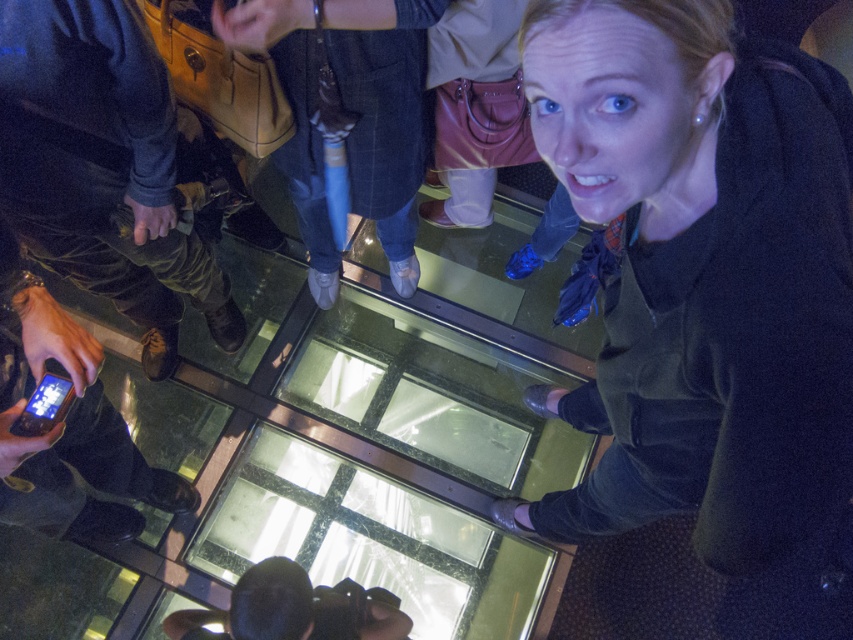
Question: Which point appears closest to the camera in this image?

Choices:
 (A) (160, 339)
 (B) (746, 147)

Answer: (B)

Question: Is velvet black sweater at upper right wider than camouflage pants at left?

Choices:
 (A) no
 (B) yes

Answer: (B)

Question: Is velvet black sweater at upper right thinner than camouflage pants at left?

Choices:
 (A) yes
 (B) no

Answer: (B)

Question: Is velvet black sweater at upper right further to the viewer compared to camouflage pants at left?

Choices:
 (A) no
 (B) yes

Answer: (A)